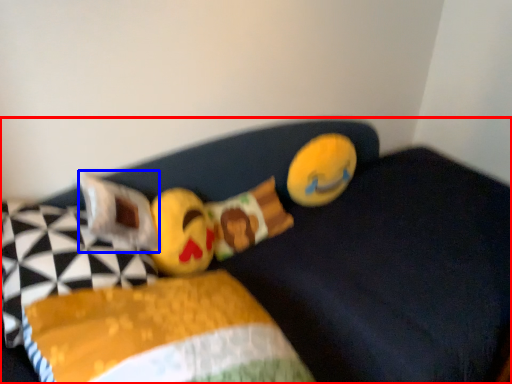
Question: Among these objects, which one is farthest to the camera, furniture (highlighted by a red box) or pillow (highlighted by a blue box)?

Choices:
 (A) furniture
 (B) pillow

Answer: (B)